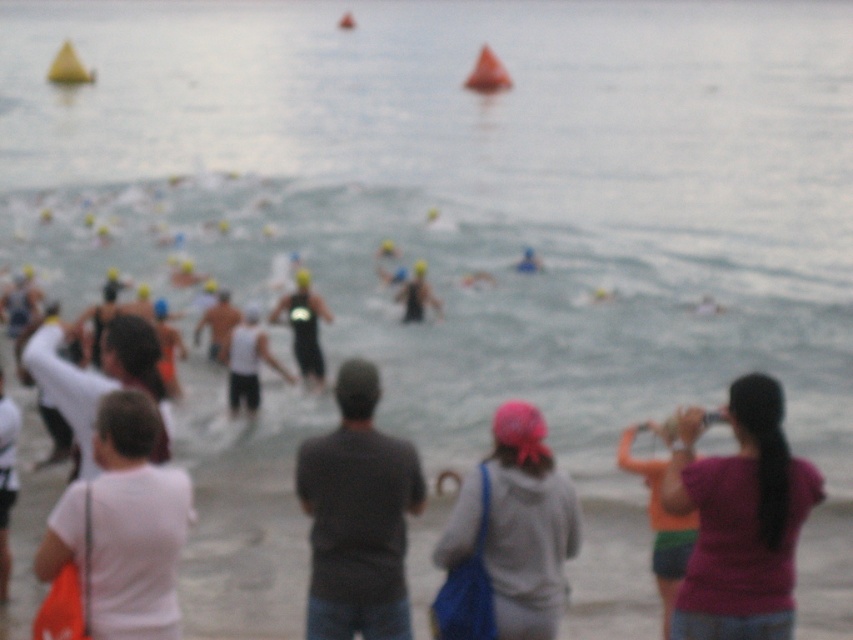
Question: Which object is the closest to the black matte wetsuit at center?

Choices:
 (A) pink fabric shirt at right
 (B) gray fabric hoodie at center
 (C) dark gray shirt at center
 (D) white matte shirt at lower left

Answer: (C)

Question: From the image, what is the correct spatial relationship of dark gray shirt at center in relation to black matte wetsuit at center?

Choices:
 (A) right
 (B) left

Answer: (A)

Question: Among these points, which one is nearest to the camera?

Choices:
 (A) (102, 413)
 (B) (519, 632)

Answer: (A)

Question: Is dark gray shirt at center below black matte wetsuit at center?

Choices:
 (A) yes
 (B) no

Answer: (A)

Question: Observing the image, what is the correct spatial positioning of pink fabric shirt at right in reference to black matte wetsuit at center?

Choices:
 (A) below
 (B) above

Answer: (A)

Question: Which point is closer to the camera taking this photo?

Choices:
 (A) (115, 588)
 (B) (780, 600)
 (C) (402, 451)

Answer: (A)